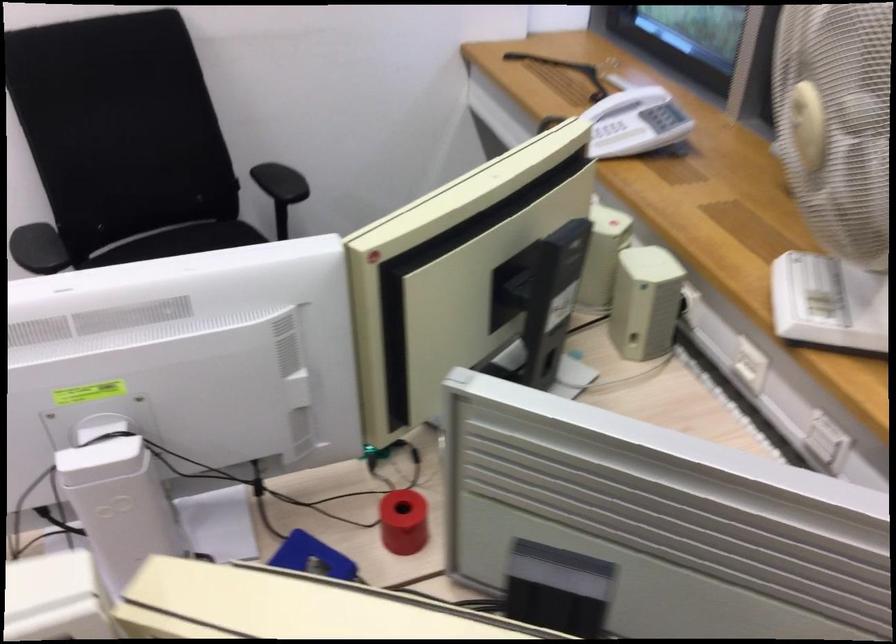
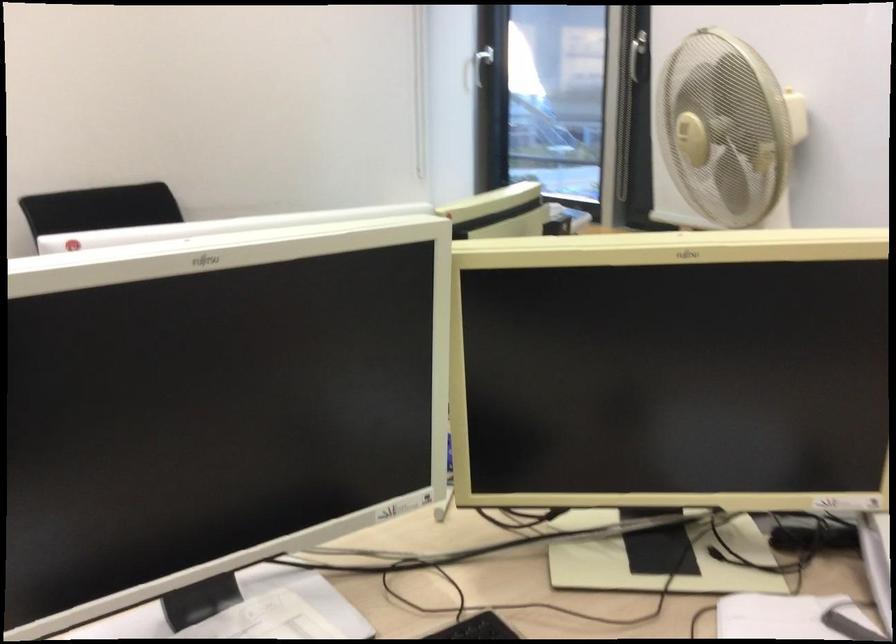
Where in the second image is the point corresponding to the point at 798,118 from the first image?

(685, 129)